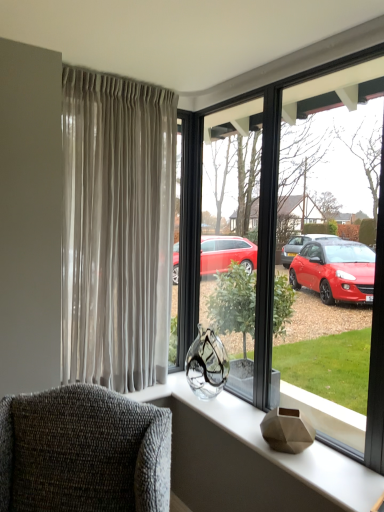
Question: Does matte gray vase at center have a lesser width compared to textured gray armchair at lower left?

Choices:
 (A) no
 (B) yes

Answer: (B)

Question: Is matte gray vase at center oriented towards textured gray armchair at lower left?

Choices:
 (A) yes
 (B) no

Answer: (A)

Question: Considering the relative sizes of matte gray vase at center and textured gray armchair at lower left in the image provided, is matte gray vase at center smaller than textured gray armchair at lower left?

Choices:
 (A) yes
 (B) no

Answer: (A)

Question: From the image's perspective, would you say matte gray vase at center is positioned over textured gray armchair at lower left?

Choices:
 (A) no
 (B) yes

Answer: (A)

Question: Does matte gray vase at center have a greater width compared to textured gray armchair at lower left?

Choices:
 (A) yes
 (B) no

Answer: (B)

Question: Would you consider matte gray vase at center to be distant from textured gray armchair at lower left?

Choices:
 (A) yes
 (B) no

Answer: (B)

Question: Can you confirm if textured gray armchair at lower left is taller than satin beige curtains at left?

Choices:
 (A) no
 (B) yes

Answer: (A)

Question: From a real-world perspective, does textured gray armchair at lower left sit lower than satin beige curtains at left?

Choices:
 (A) no
 (B) yes

Answer: (B)

Question: Is textured gray armchair at lower left facing away from satin beige curtains at left?

Choices:
 (A) no
 (B) yes

Answer: (A)

Question: Considering the relative positions of textured gray armchair at lower left and satin beige curtains at left in the image provided, is textured gray armchair at lower left to the left of satin beige curtains at left from the viewer's perspective?

Choices:
 (A) yes
 (B) no

Answer: (A)

Question: From the image's perspective, is textured gray armchair at lower left beneath satin beige curtains at left?

Choices:
 (A) yes
 (B) no

Answer: (A)

Question: Can you confirm if textured gray armchair at lower left is positioned to the right of satin beige curtains at left?

Choices:
 (A) yes
 (B) no

Answer: (B)

Question: Can you confirm if satin beige curtains at left is taller than matte gray vase at center?

Choices:
 (A) yes
 (B) no

Answer: (A)